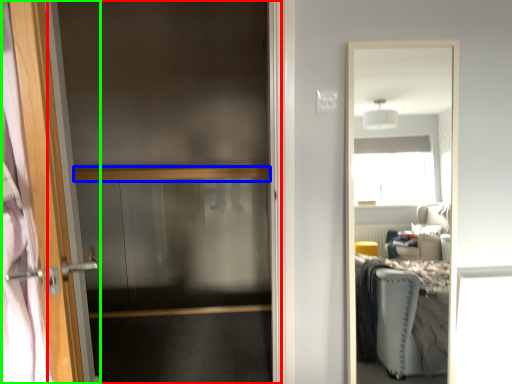
Question: Based on their relative distances, which object is nearer to screen door (highlighted by a red box)? Choose from balustrade (highlighted by a blue box) and door (highlighted by a green box).

Choices:
 (A) balustrade
 (B) door

Answer: (A)